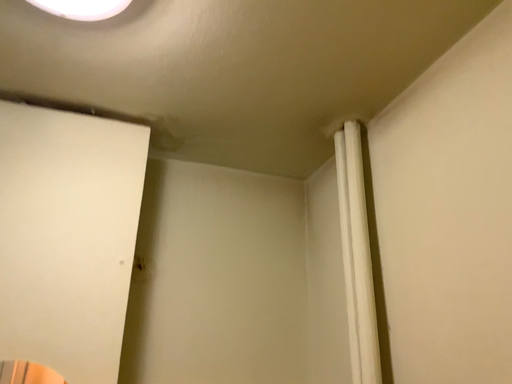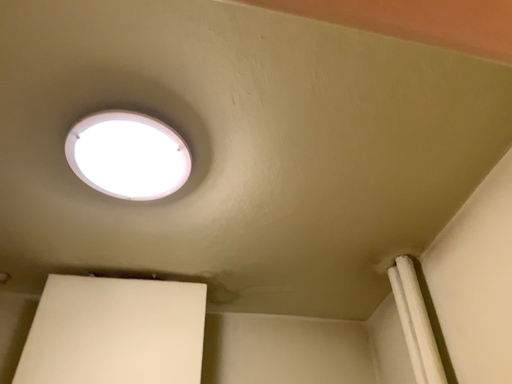
Question: How did the camera likely rotate when shooting the video?

Choices:
 (A) rotated upward
 (B) rotated downward

Answer: (A)